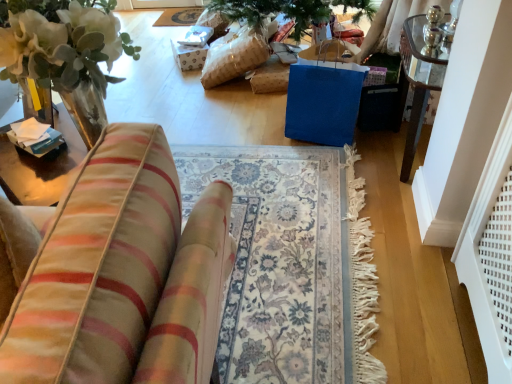
Question: Does velvet striped cushion at left have a lesser width compared to silky blue mat at upper center?

Choices:
 (A) yes
 (B) no

Answer: (A)

Question: Is silky blue mat at upper center a part of velvet striped cushion at left?

Choices:
 (A) no
 (B) yes

Answer: (A)

Question: Is velvet striped cushion at left facing away from silky blue mat at upper center?

Choices:
 (A) yes
 (B) no

Answer: (B)

Question: From a real-world perspective, is velvet striped cushion at left on silky blue mat at upper center?

Choices:
 (A) yes
 (B) no

Answer: (A)

Question: Is velvet striped cushion at left in front of silky blue mat at upper center?

Choices:
 (A) no
 (B) yes

Answer: (B)

Question: From the image's perspective, is velvet striped cushion at left on silky blue mat at upper center?

Choices:
 (A) no
 (B) yes

Answer: (A)

Question: Does silky blue mat at upper center lie behind velvet striped cushion at left?

Choices:
 (A) yes
 (B) no

Answer: (A)

Question: From the image's perspective, does silky blue mat at upper center appear higher than velvet striped cushion at left?

Choices:
 (A) no
 (B) yes

Answer: (B)

Question: Considering the relative sizes of silky blue mat at upper center and velvet striped cushion at left in the image provided, is silky blue mat at upper center wider than velvet striped cushion at left?

Choices:
 (A) yes
 (B) no

Answer: (A)

Question: Can you confirm if silky blue mat at upper center is shorter than velvet striped cushion at left?

Choices:
 (A) no
 (B) yes

Answer: (B)

Question: Can velvet striped cushion at left be found inside silky blue mat at upper center?

Choices:
 (A) no
 (B) yes

Answer: (A)

Question: From the image's perspective, is silky blue mat at upper center under velvet striped cushion at left?

Choices:
 (A) no
 (B) yes

Answer: (A)

Question: From the image's perspective, is velvet striped cushion at left above or below silky blue mat at upper center?

Choices:
 (A) below
 (B) above

Answer: (A)